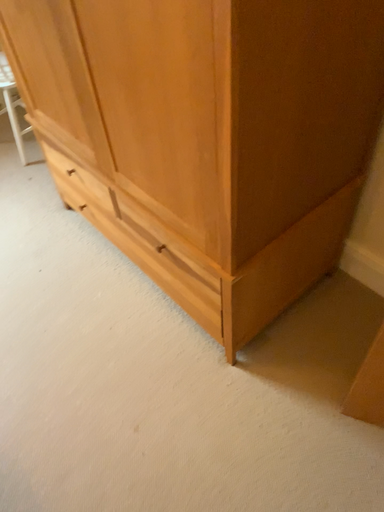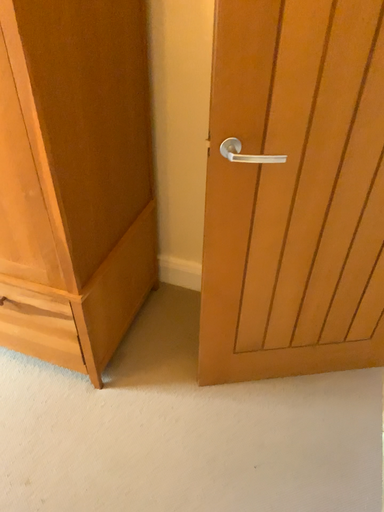
Question: Which way did the camera rotate in the video?

Choices:
 (A) rotated left
 (B) rotated right

Answer: (B)